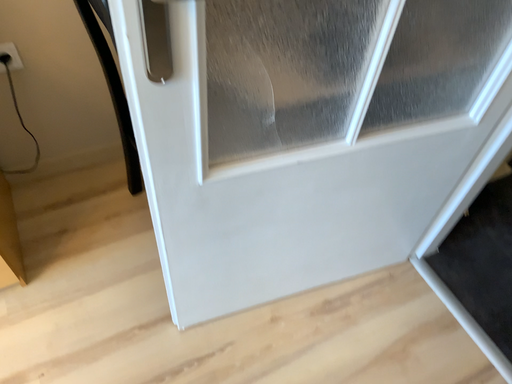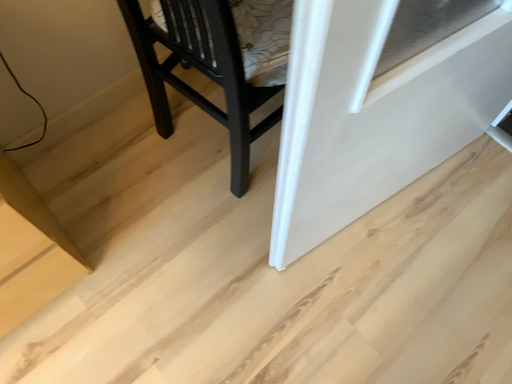
Question: How did the camera likely rotate when shooting the video?

Choices:
 (A) rotated upward
 (B) rotated downward

Answer: (B)